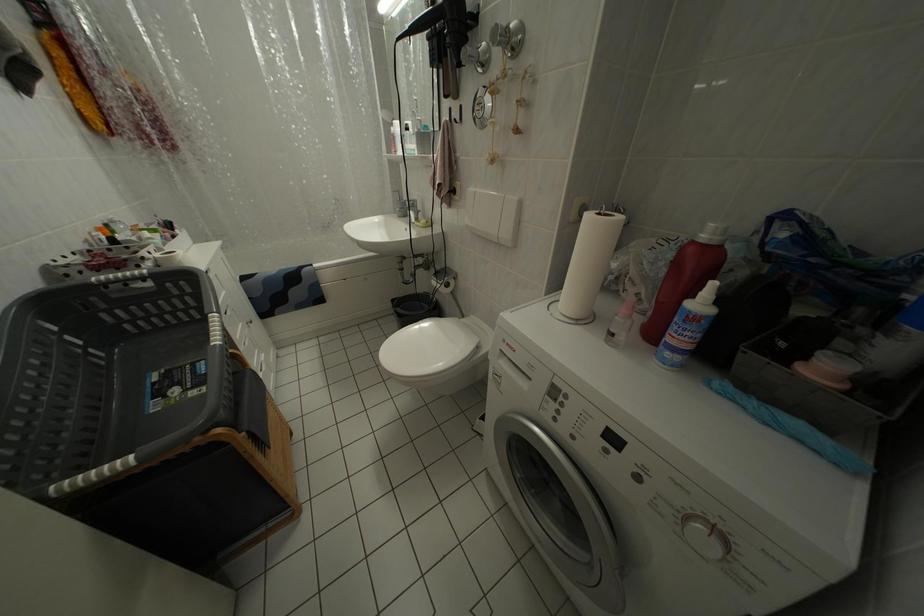
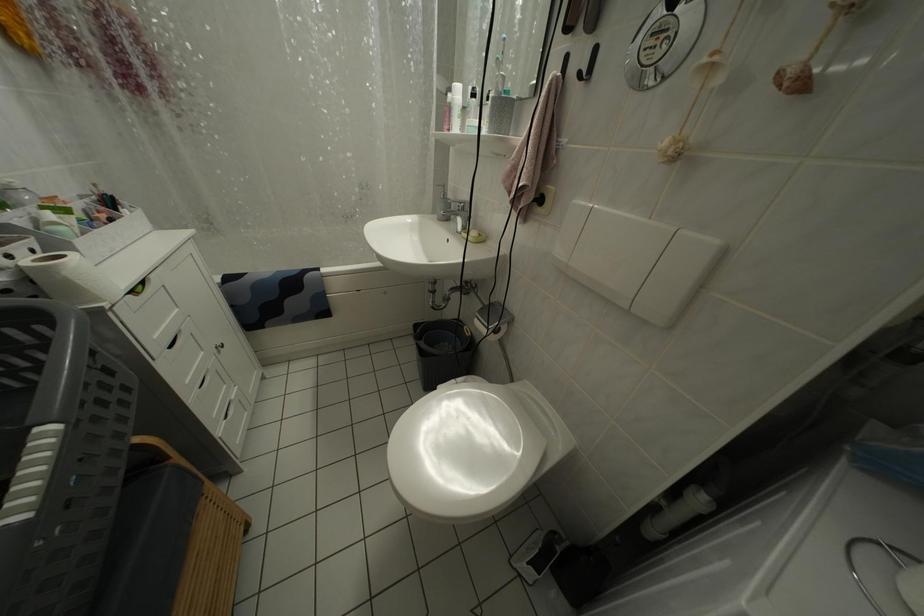
Which direction would the cameraman need to move to produce the second image?

The movement direction of the cameraman is left, forward.